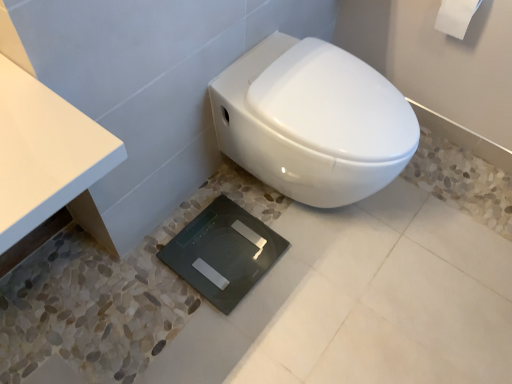
Find the location of a particular element. This screenshot has width=512, height=384. free space in front of black glass scale at center is located at coordinates (211, 338).